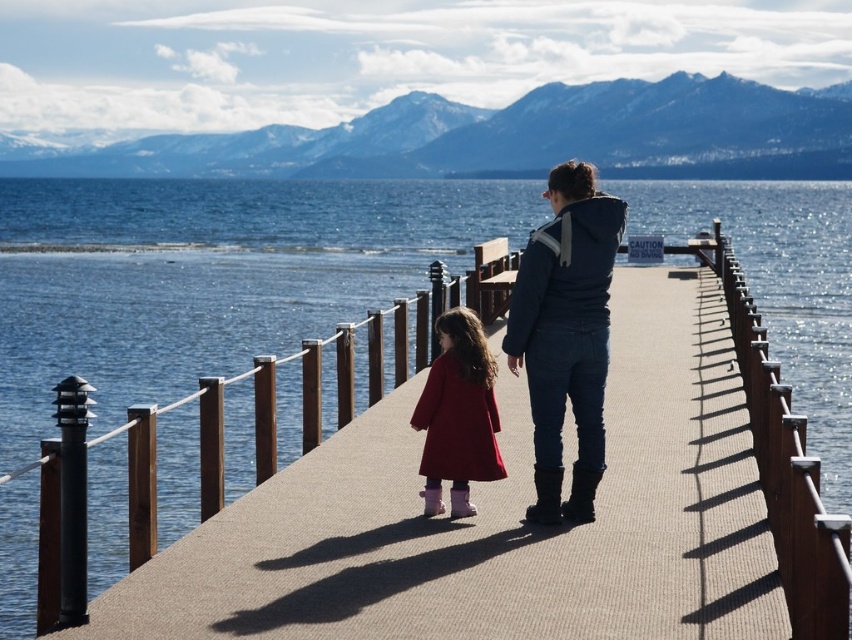
You are standing on the pier and see the blue water at center and the denim jacket at center. Which one is higher from the ground?

The blue water at center is located above the denim jacket at center, so the blue water at center is higher.

You are standing on the pier and want to take a photo of both the denim jacket at center and the matte red coat at center. Which one should you position closer to the left side of your camera frame?

You should position the matte red coat at center closer to the left side of your camera frame because the denim jacket at center is to the right of it.

You are standing on the pier and want to know if the blue water at center is wider than the matte red coat at center. Can you confirm this?

The blue water at center is wider than matte red coat at center according to the description.